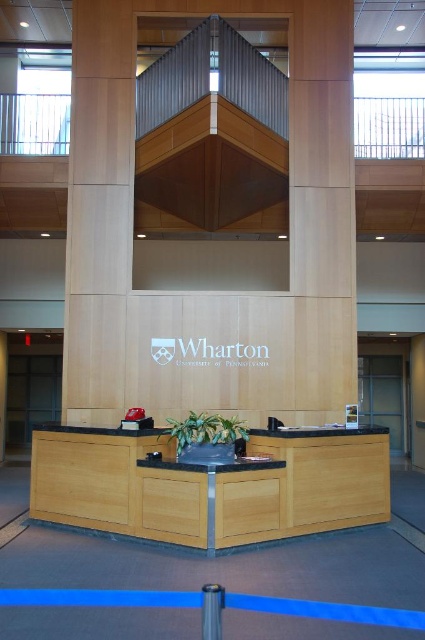
Question: Which object appears closest to the camera in this image?

Choices:
 (A) light wood paneling at center
 (B) light wood/black laminate information desk at center

Answer: (B)

Question: Is light wood/black laminate information desk at center closer to camera compared to light wood paneling at center?

Choices:
 (A) no
 (B) yes

Answer: (B)

Question: Is light wood/black laminate information desk at center wider than light wood paneling at center?

Choices:
 (A) yes
 (B) no

Answer: (A)

Question: Among these objects, which one is farthest from the camera?

Choices:
 (A) light wood/black laminate information desk at center
 (B) light wood paneling at center

Answer: (B)

Question: Which point is closer to the camera?

Choices:
 (A) light wood paneling at center
 (B) light wood/black laminate information desk at center

Answer: (B)

Question: Considering the relative positions of light wood/black laminate information desk at center and light wood paneling at center in the image provided, where is light wood/black laminate information desk at center located with respect to light wood paneling at center?

Choices:
 (A) above
 (B) below

Answer: (B)